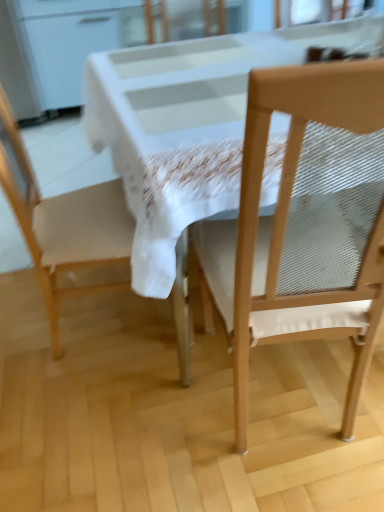
The image size is (384, 512). Find the location of `vacant area situated below matte white chair at left, which appears as the 2th chair when viewed from the right (from a real-world perspective)`. vacant area situated below matte white chair at left, which appears as the 2th chair when viewed from the right (from a real-world perspective) is located at coordinates (97, 318).